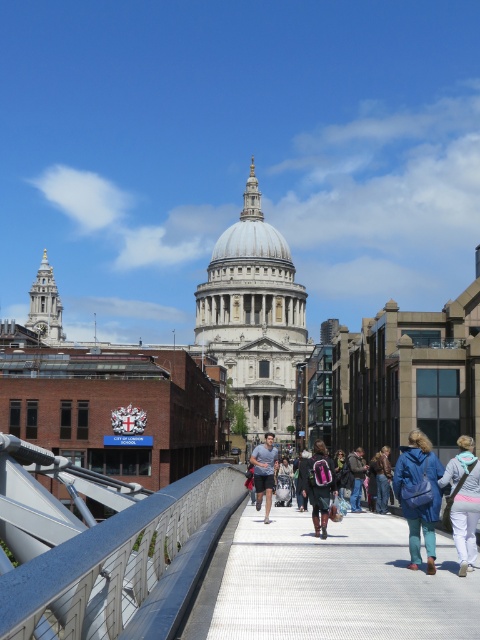
This screenshot has width=480, height=640. Find the location of `blue fabric jacket at lower right`. blue fabric jacket at lower right is located at coordinates (464, 500).

Find the location of a particular element. blue fabric jacket at lower right is located at coordinates tap(464, 500).

Is pink fabric backpack at center smaller than denim jacket at center?

Incorrect, pink fabric backpack at center is not smaller in size than denim jacket at center.

Is point (325, 486) farther from viewer compared to point (360, 451)?

No, it is not.

Is point (321, 483) farther from viewer compared to point (351, 512)?

No, (321, 483) is closer to viewer.

Locate an element on the screen. The height and width of the screenshot is (640, 480). pink fabric backpack at center is located at coordinates (319, 484).

Is metallic gray bridge at center below white textured pavement at center?

Incorrect, metallic gray bridge at center is not positioned below white textured pavement at center.

Does metallic gray bridge at center have a lesser height compared to white textured pavement at center?

Incorrect, metallic gray bridge at center's height does not fall short of white textured pavement at center's.

Describe the element at coordinates (103, 547) in the screenshot. I see `metallic gray bridge at center` at that location.

Find the location of a particular element. metallic gray bridge at center is located at coordinates (103, 547).